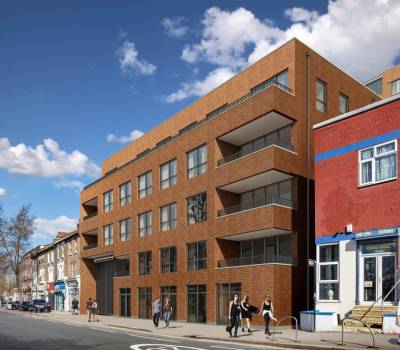
The width and height of the screenshot is (400, 350). I want to click on stairs, so click(x=357, y=306), click(x=356, y=311), click(x=354, y=317).